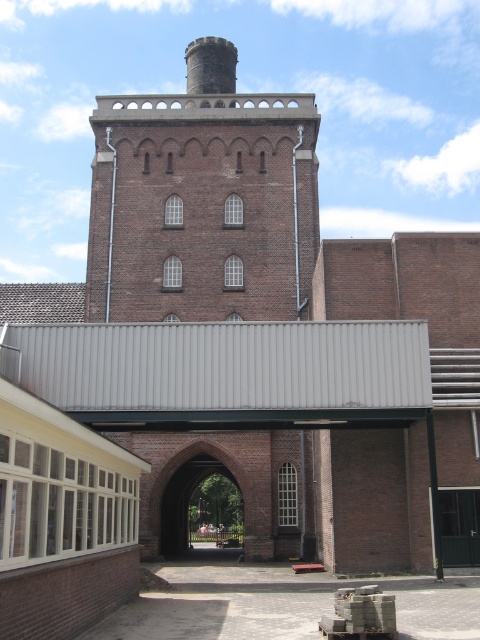
You are an architect reviewing the blueprint of the building shown. You need to place a new sensor on the side of the brown brick tower at upper center that faces away from the smooth gray chimney at upper center. Which direction should the sensor face?

The brown brick tower at upper center is positioned on the right side of smooth gray chimney at upper center. Therefore, the sensor should face to the left to be away from the smooth gray chimney at upper center.